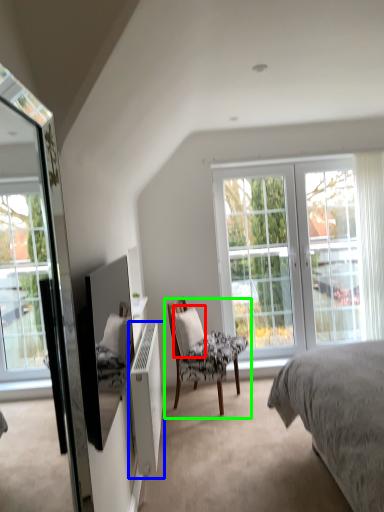
Question: Which object is the closest to the pillow (highlighted by a red box)? Choose among these: radiator (highlighted by a blue box) or chair (highlighted by a green box).

Choices:
 (A) radiator
 (B) chair

Answer: (B)